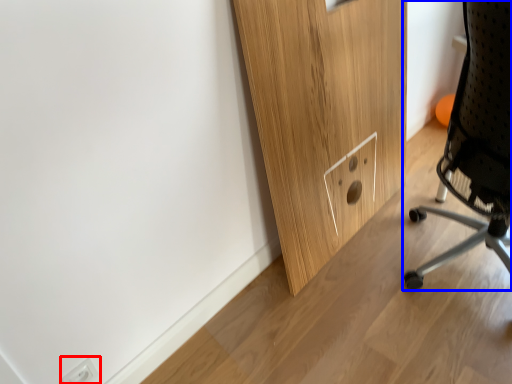
Question: Which object appears closest to the camera in this image, electric outlet (highlighted by a red box) or chair (highlighted by a blue box)?

Choices:
 (A) electric outlet
 (B) chair

Answer: (B)